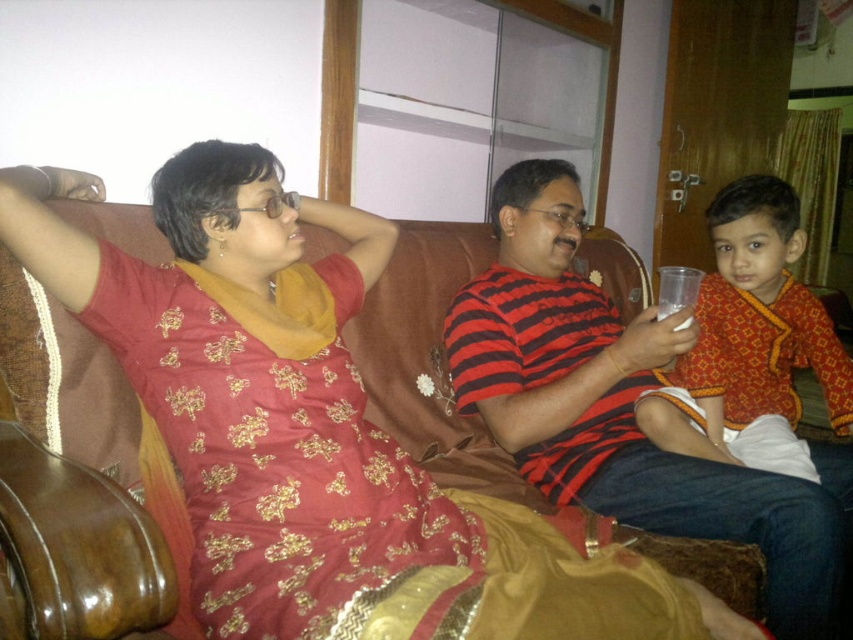
In the living room scene, there is a striped cotton shirt at center and a clear plastic cup at center. Which object is taller?

The striped cotton shirt at center is taller than the clear plastic cup at center.

You are a delivery person carrying a package that requires a 10 inch clearance to pass between the striped cotton shirt at center and the matte orange shirt at right. Can you safely navigate through this space?

The distance between the striped cotton shirt at center and the matte orange shirt at right is 8.54 inches, which is less than the required 10 inch clearance. Therefore, you cannot safely navigate through this space with the package.